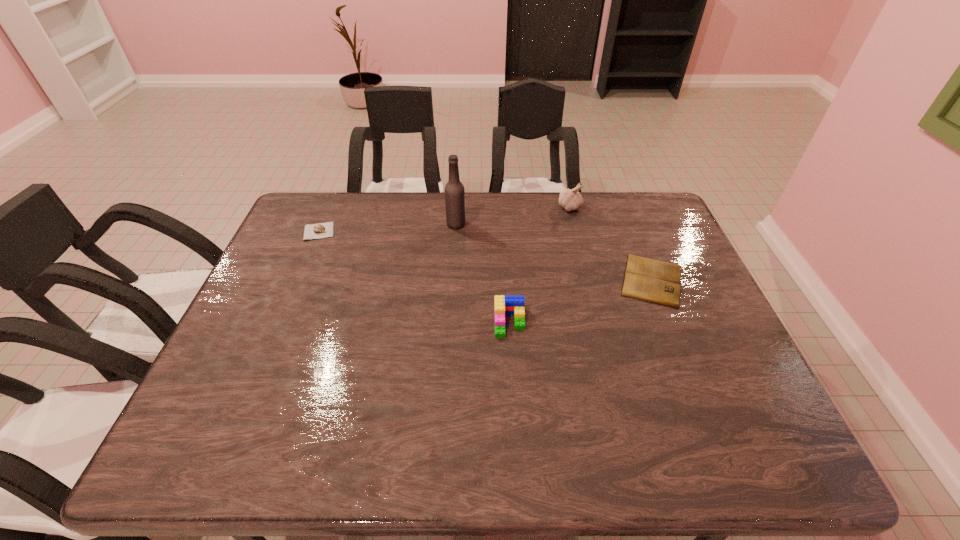
At what (x,y) coordinates should I click in order to perform the action: click on vacant area at the near edge of the desktop. Please return your answer as a coordinate pair (x, y). This screenshot has height=540, width=960. Looking at the image, I should click on (351, 446).

Where is `vacant space at the left edge`? The width and height of the screenshot is (960, 540). vacant space at the left edge is located at coordinates (322, 255).

In the image, there is a desktop. Where is `free space at the right edge`? free space at the right edge is located at coordinates (685, 320).

In the image, there is a desktop. Where is `free space at the near left corner`? Image resolution: width=960 pixels, height=540 pixels. free space at the near left corner is located at coordinates (252, 447).

In the image, there is a desktop. Identify the location of vacant space at the far right corner. (656, 223).

In the image, there is a desktop. Identify the location of free space at the near right corner. Image resolution: width=960 pixels, height=540 pixels. (754, 440).

Where is `vacant space that is in between the farthest object and the second object from left to right`? This screenshot has height=540, width=960. vacant space that is in between the farthest object and the second object from left to right is located at coordinates [513, 216].

Where is `vacant area that lies between the shorter garlic and the rightmost object`? vacant area that lies between the shorter garlic and the rightmost object is located at coordinates point(486,255).

Where is `free space between the beer bottle and the taller garlic`? This screenshot has width=960, height=540. free space between the beer bottle and the taller garlic is located at coordinates (x=513, y=216).

Locate an element on the screen. unoccupied area between the taller garlic and the rightmost object is located at coordinates (611, 244).